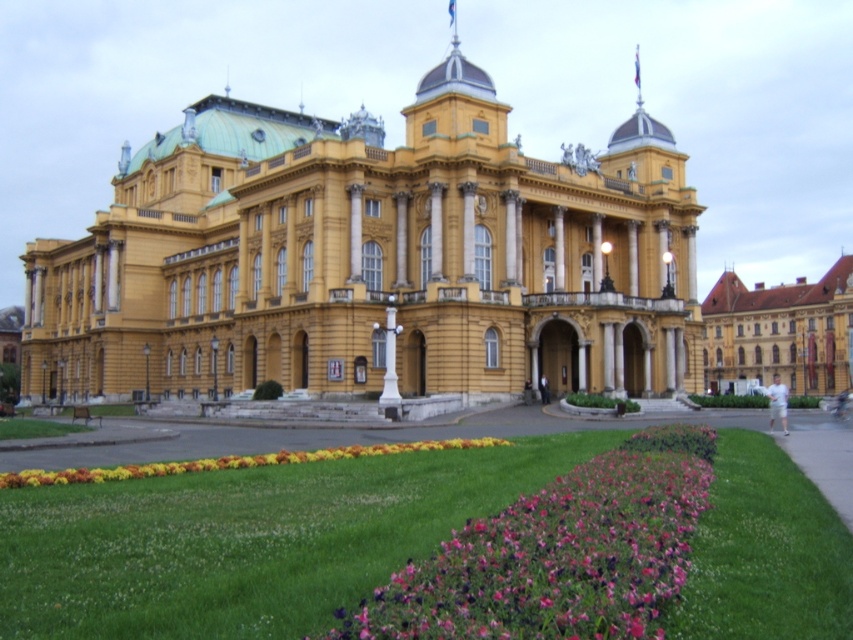
You are standing at the entrance of the grand building and notice the green grass at lower center and the purple matte flowers at lower center. Which of these two elements is positioned lower in the scene?

The green grass at lower center is located below the purple matte flowers at lower center, so it is positioned lower in the scene.

You are standing in front of the yellow stone building at center and want to take a photo of the multicolored fabric flower bed at lower center. Since the flower bed is shorter than the building, where should you position yourself to ensure the entire flower bed is visible in your photo?

The yellow stone building at center is taller than the multicolored fabric flower bed at lower center. To capture the entire flower bed in your photo, position yourself at a lower angle or closer to the flower bed to avoid the building blocking the view.

You are a gardener standing at the entrance of the building. You need to water both the green grass at lower center and the purple matte flowers at lower center. Which one is closer to you?

The green grass at lower center is 16.67 feet away from purple matte flowers at lower center. Therefore, both are at the same distance from you since they are positioned at lower center.